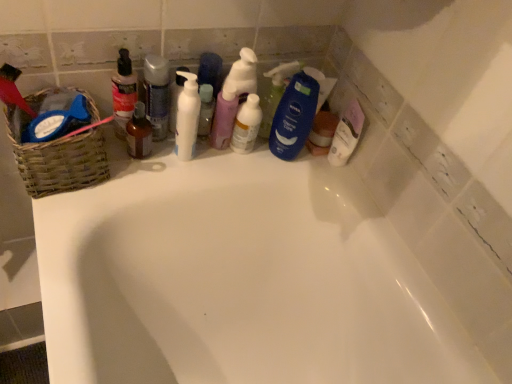
Question: From the image's perspective, is woven brown basket at left above or below translucent plastic spray bottle at center, the second cleaning product viewed from the right?

Choices:
 (A) below
 (B) above

Answer: (A)

Question: From a real-world perspective, is woven brown basket at left physically located above or below translucent plastic spray bottle at center, the second cleaning product viewed from the right?

Choices:
 (A) below
 (B) above

Answer: (A)

Question: Which of these objects is positioned farthest from the woven brown basket at left?

Choices:
 (A) translucent plastic spray bottle at center, the first cleaning product in the left-to-right sequence
 (B) translucent plastic bottle at upper left
 (C) blue matte bottle at center, the 4th cleaning product when ordered from left to right
 (D) white glossy bathtub at upper center
 (E) translucent plastic spray bottle at center, the second cleaning product viewed from the right

Answer: (C)

Question: Estimate the real-world distances between objects in this image. Which object is farther from the woven brown basket at left?

Choices:
 (A) translucent plastic bottle at upper left
 (B) translucent plastic spray bottle at center, which is counted as the third cleaning product, starting from the left
 (C) pastel pink pump bottle at center, the 3th cleaning product when ordered from right to left
 (D) translucent plastic spray bottle at center, the first cleaning product in the left-to-right sequence
 (E) brown glass bottle at center

Answer: (B)